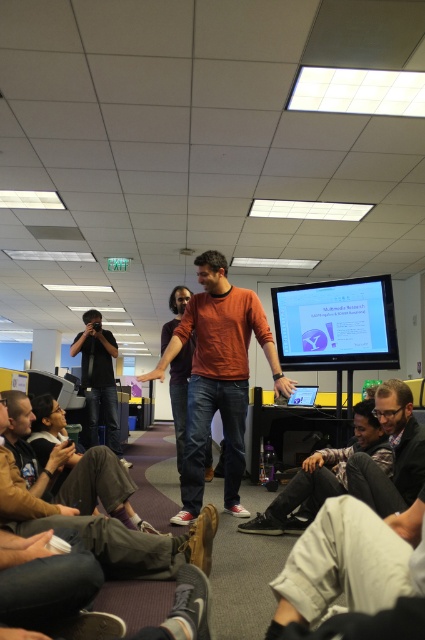
Which is below, black matte camera at left or jeans at center?

black matte camera at left is below.

Can you confirm if black matte camera at left is positioned to the left of jeans at center?

Indeed, black matte camera at left is positioned on the left side of jeans at center.

Is point (96, 401) positioned behind point (176, 410)?

Yes.

Find the location of a particular element. This screenshot has height=640, width=425. black matte camera at left is located at coordinates (99, 380).

Does point (326, 477) come closer to viewer compared to point (96, 424)?

Yes, it is in front of point (96, 424).

Can you confirm if dark gray jeans at lower center is shorter than black matte camera at left?

Yes.

Is point (283, 492) positioned behind point (88, 442)?

That is False.

Image resolution: width=425 pixels, height=640 pixels. Find the location of `dark gray jeans at lower center`. dark gray jeans at lower center is located at coordinates (323, 477).

Describe the element at coordinates (102, 524) in the screenshot. I see `brown suede shoes at lower center` at that location.

Is brown suede shoes at lower center above black matte camera at left?

Correct, brown suede shoes at lower center is located above black matte camera at left.

This screenshot has width=425, height=640. What are the coordinates of `brown suede shoes at lower center` in the screenshot? It's located at (102, 524).

The width and height of the screenshot is (425, 640). Identify the location of brown suede shoes at lower center. (102, 524).